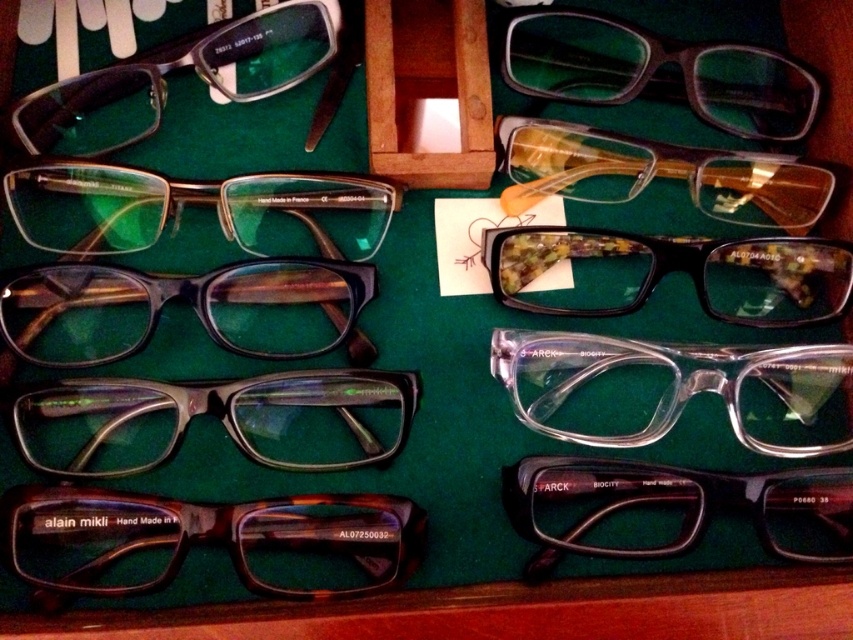
Consider the image. You are organizing a display of glasses and need to place a new pair between the matte black glasses at center and the translucent plastic glasses at upper right. Based on their current positions, where should you place the new pair?

Since the matte black glasses at center is positioned under the translucent plastic glasses at upper right, you should place the new pair above the matte black glasses at center and below the translucent plastic glasses at upper right to maintain the existing arrangement.

You are a customer trying to pick up the tortoiseshell acetate glasses at bottom left from the display. Will you need to move the clear plastic glasses at center first?

The tortoiseshell acetate glasses at bottom left is in front of the clear plastic glasses at center, so you can pick it up without moving the clear plastic glasses at center first.

You are looking at a display of eyeglasses on a dark green surface. There are two points marked in the image, point 1 at coordinates point (x=114, y=196) and point 2 at coordinates point (x=564, y=244). Which point is closer to you?

Point (x=114, y=196) is in front of point (x=564, y=244), so point 1 is closer to you.